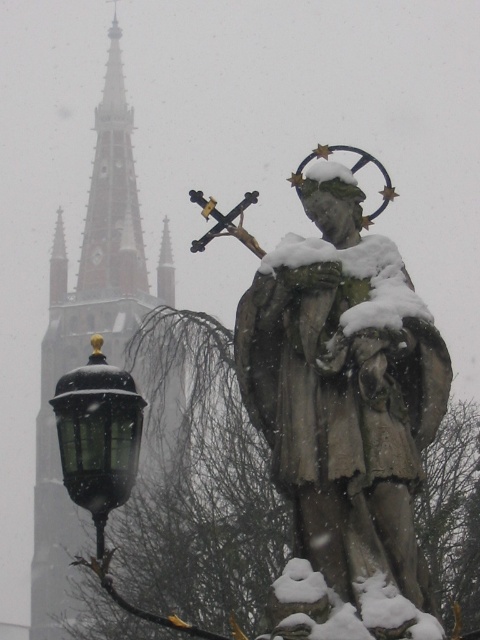
From the picture: Does brick steeple at upper left appear over smooth stone spire at upper left?

No, brick steeple at upper left is not above smooth stone spire at upper left.

Is brick steeple at upper left below smooth stone spire at upper left?

Yes.

Is point (57, 445) closer to camera compared to point (166, 227)?

Yes, it is in front of point (166, 227).

Locate an element on the screen. The height and width of the screenshot is (640, 480). brick steeple at upper left is located at coordinates (85, 333).

Which is in front, point (291, 474) or point (129, 420)?

Point (291, 474) is more forward.

Describe the element at coordinates (344, 416) in the screenshot. I see `snow-covered stone statue at center` at that location.

This screenshot has height=640, width=480. In order to click on snow-covered stone statue at center in this screenshot , I will do `click(344, 416)`.

Looking at this image, which is above, brick steeple at upper left or black glass lamp post at left?

brick steeple at upper left is above.

Which is below, brick steeple at upper left or black glass lamp post at left?

black glass lamp post at left is lower down.

Is point (129, 230) farther from viewer compared to point (74, 410)?

Yes, it is behind point (74, 410).

The image size is (480, 640). Find the location of `brick steeple at upper left`. brick steeple at upper left is located at coordinates (85, 333).